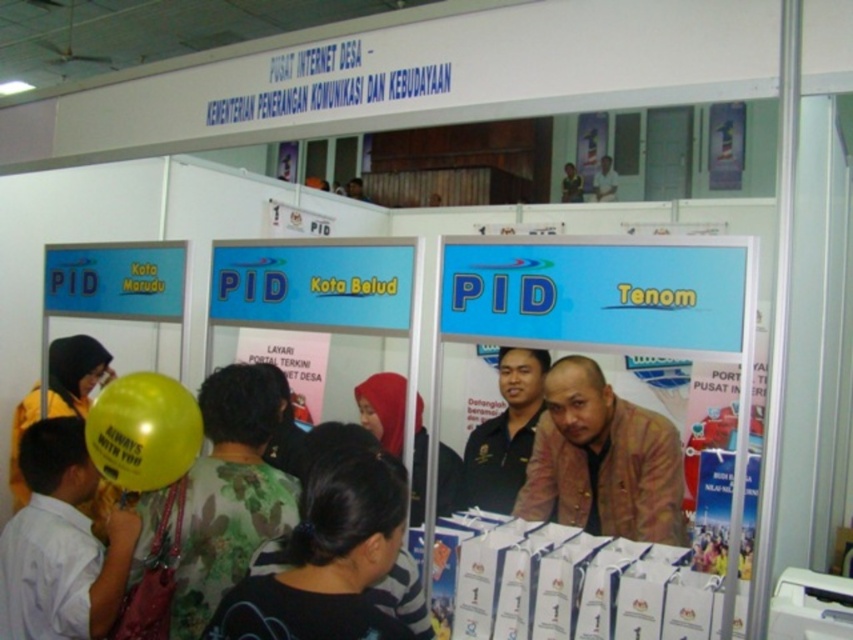
Does matte black shirt at center have a greater width compared to light brown leather jacket at upper center?

Yes, matte black shirt at center is wider than light brown leather jacket at upper center.

Between matte black shirt at center and light brown leather jacket at upper center, which one is positioned higher?

light brown leather jacket at upper center is above.

Locate an element on the screen. This screenshot has height=640, width=853. matte black shirt at center is located at coordinates (383, 408).

Is yellow rubber balloon at lower left to the left of light brown leather jacket at upper center from the viewer's perspective?

Yes, yellow rubber balloon at lower left is to the left of light brown leather jacket at upper center.

Is point (44, 484) positioned behind point (616, 179)?

No, it is not.

Measure the distance between point [51,564] and camera.

They are 1.84 meters apart.

Locate an element on the screen. Image resolution: width=853 pixels, height=640 pixels. yellow rubber balloon at lower left is located at coordinates (61, 544).

Is shiny yellow balloon at lower left further to the viewer compared to dark brown leather jacket at upper center?

No, it is in front of dark brown leather jacket at upper center.

Where is `shiny yellow balloon at lower left`? The height and width of the screenshot is (640, 853). shiny yellow balloon at lower left is located at coordinates (143, 432).

Between point (141, 488) and point (579, 195), which one is positioned in front?

Positioned in front is point (141, 488).

Where is `shiny yellow balloon at lower left`? The width and height of the screenshot is (853, 640). shiny yellow balloon at lower left is located at coordinates (143, 432).